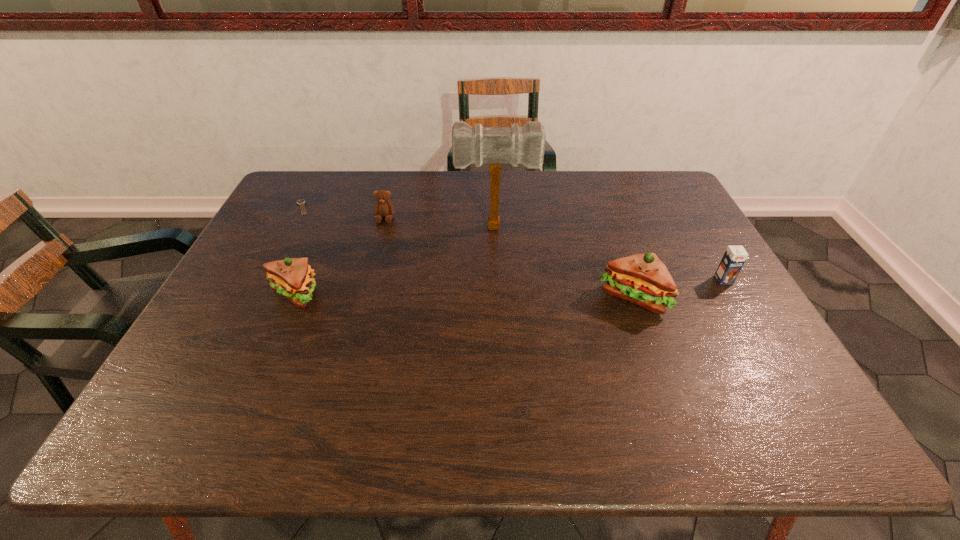
The width and height of the screenshot is (960, 540). What are the coordinates of `free location at the far edge of the desktop` in the screenshot? It's located at 421,175.

Image resolution: width=960 pixels, height=540 pixels. What are the coordinates of `free space at the near edge of the desktop` in the screenshot? It's located at (651, 384).

In the image, there is a desktop. Where is `vacant space at the left edge`? vacant space at the left edge is located at coordinates (248, 279).

Find the location of a particular element. This screenshot has width=960, height=540. free space at the right edge is located at coordinates (660, 256).

Where is `vacant space that is in between the left sandwich and the mallet`? This screenshot has height=540, width=960. vacant space that is in between the left sandwich and the mallet is located at coordinates (395, 261).

Identify the location of free space between the fourth object from right to left and the left sandwich. (340, 256).

Identify the location of empty space between the rightmost object and the shortest object. (513, 244).

Locate an element on the screen. Image resolution: width=960 pixels, height=540 pixels. unoccupied area between the shortest object and the rightmost object is located at coordinates click(x=513, y=244).

Locate an element on the screen. The height and width of the screenshot is (540, 960). unoccupied area between the left sandwich and the third object from left to right is located at coordinates (340, 256).

Find the location of a particular element. The width and height of the screenshot is (960, 540). free space between the chocolate milk and the watch is located at coordinates (513, 244).